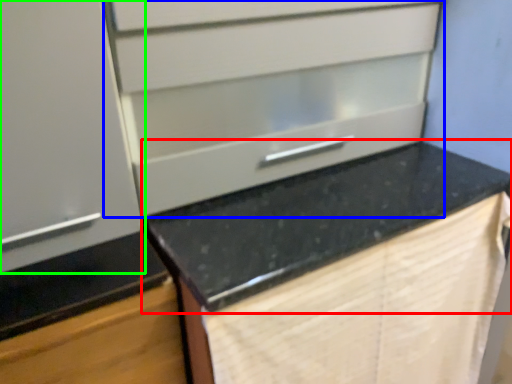
Question: Which object is the closest to the countertop (highlighted by a red box)? Choose among these: drawer (highlighted by a blue box) or cabinetry (highlighted by a green box).

Choices:
 (A) drawer
 (B) cabinetry

Answer: (A)